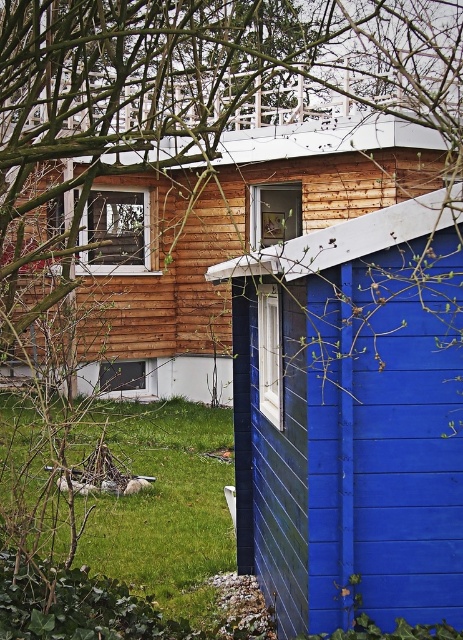
Question: Which of the following is the farthest from the observer?

Choices:
 (A) (400, 513)
 (B) (304, 227)

Answer: (B)

Question: Which object appears farthest from the camera in this image?

Choices:
 (A) green grass at lower left
 (B) blue wooden shed at right
 (C) wooden cabin at center

Answer: (C)

Question: Can you confirm if blue wooden shed at right is positioned above green grass at lower left?

Choices:
 (A) yes
 (B) no

Answer: (A)

Question: Is blue wooden shed at right above wooden cabin at center?

Choices:
 (A) yes
 (B) no

Answer: (B)

Question: Based on their relative distances, which object is nearer to the green grass at lower left?

Choices:
 (A) blue wooden shed at right
 (B) wooden cabin at center

Answer: (A)

Question: Is the position of blue wooden shed at right less distant than that of wooden cabin at center?

Choices:
 (A) yes
 (B) no

Answer: (A)